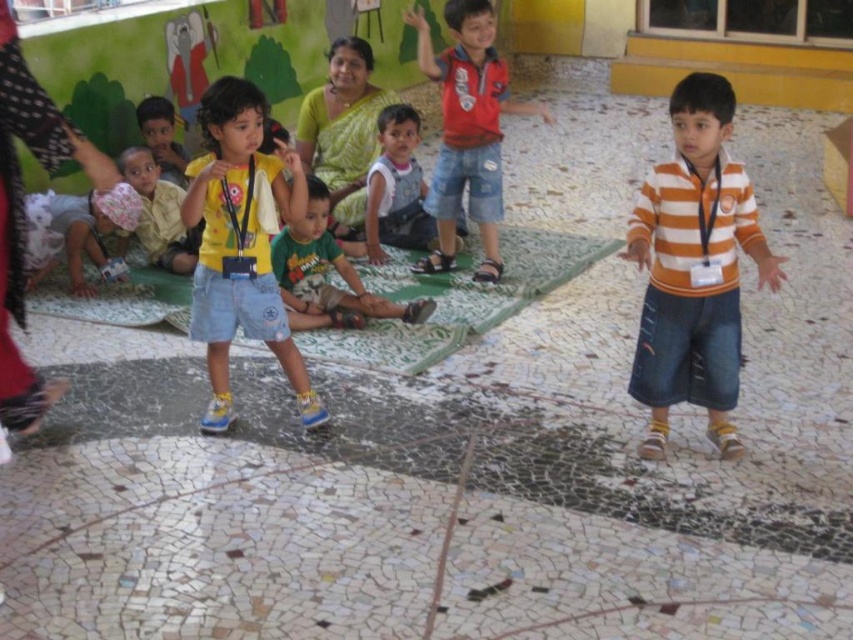
Describe the element at coordinates (241, 244) in the screenshot. I see `yellow cotton shirt at center` at that location.

Which is below, yellow cotton shirt at center or light brown cotton shirt at left?

yellow cotton shirt at center is below.

What do you see at coordinates (241, 244) in the screenshot? I see `yellow cotton shirt at center` at bounding box center [241, 244].

I want to click on yellow cotton shirt at center, so click(241, 244).

Does red shirt at center appear on the left side of light green jersey at center?

Incorrect, red shirt at center is not on the left side of light green jersey at center.

Does red shirt at center appear over light green jersey at center?

Yes, red shirt at center is above light green jersey at center.

Where is `red shirt at center`? This screenshot has height=640, width=853. red shirt at center is located at coordinates (467, 131).

The width and height of the screenshot is (853, 640). Find the location of `red shirt at center`. red shirt at center is located at coordinates [467, 131].

The image size is (853, 640). Describe the element at coordinates (694, 266) in the screenshot. I see `orange striped shirt at right` at that location.

Does point (735, 371) come in front of point (329, 243)?

That is True.

Locate an element on the screen. The height and width of the screenshot is (640, 853). orange striped shirt at right is located at coordinates (694, 266).

Where is `orange striped shirt at right`? This screenshot has height=640, width=853. orange striped shirt at right is located at coordinates (694, 266).